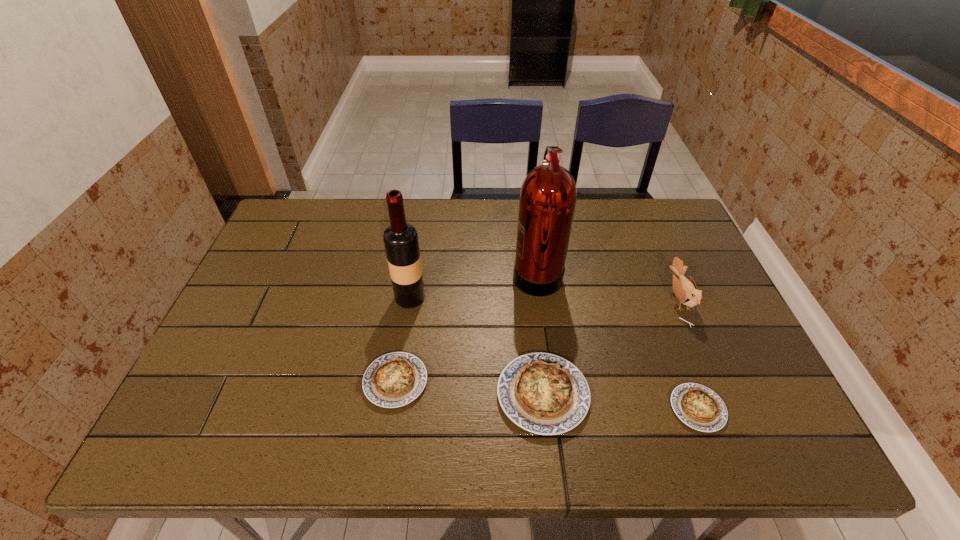
Find the location of a particular element. The image size is (960, 540). vacant area situated 0.350m on the right of the tallest quiche is located at coordinates (741, 395).

Where is `free space located on the back of the rightmost quiche`? Image resolution: width=960 pixels, height=540 pixels. free space located on the back of the rightmost quiche is located at coordinates (660, 308).

You are a GUI agent. You are given a task and a screenshot of the screen. Output one action in this format:
    pyautogui.click(x=<x>, y=<y>)
    Task: Click on the free space located on the front-facing side of the fire extinguisher
    Image resolution: width=960 pixels, height=540 pixels.
    Given the screenshot: What is the action you would take?
    pyautogui.click(x=438, y=272)

Identify the location of free space located 0.360m on the front-facing side of the fire extinguisher. (390, 272).

Locate an element on the screen. vacant space located on the front-facing side of the fire extinguisher is located at coordinates (390, 272).

The image size is (960, 540). In order to click on vacant region located 0.190m on the left of the fifth shortest object in this screenshot , I will do `click(326, 297)`.

Locate an element on the screen. The width and height of the screenshot is (960, 540). free space located 0.240m at the beak of the bird is located at coordinates (582, 300).

The image size is (960, 540). I want to click on free space located at the beak of the bird, so click(x=585, y=300).

Locate an element on the screen. vacant region located at the beak of the bird is located at coordinates (570, 300).

Where is `quiche located in the right edge section of the desktop`? quiche located in the right edge section of the desktop is located at coordinates (699, 407).